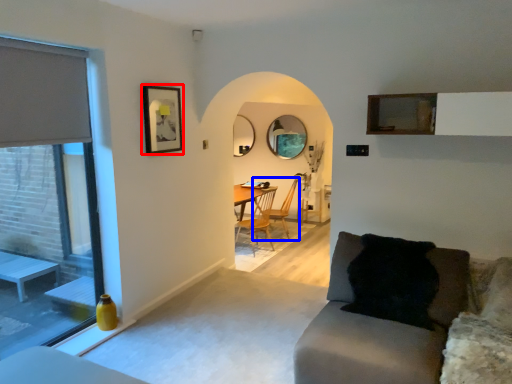
Question: Which point is further to the camera, picture frame (highlighted by a red box) or chair (highlighted by a blue box)?

Choices:
 (A) picture frame
 (B) chair

Answer: (B)